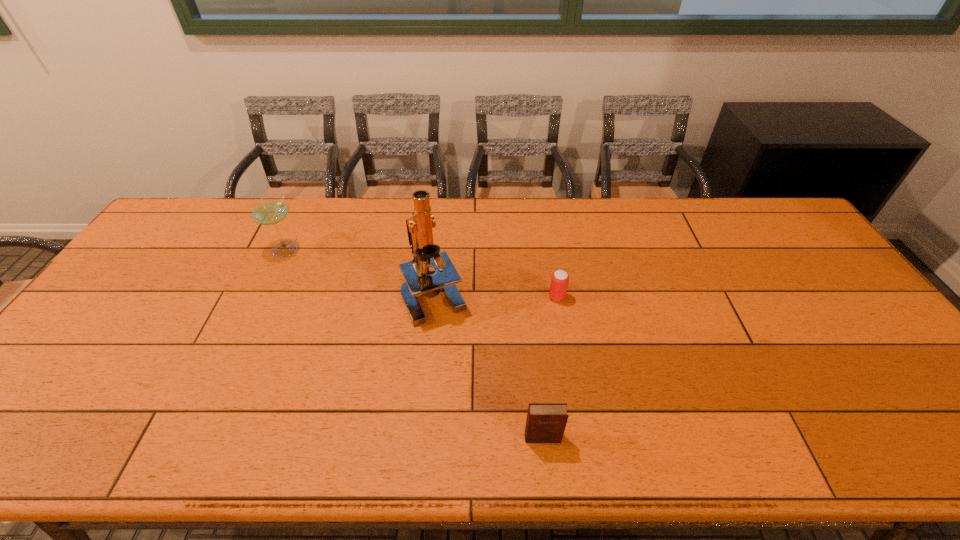
Image resolution: width=960 pixels, height=540 pixels. Find the location of `unoccupied position between the rightmost object and the second object from right to left`. unoccupied position between the rightmost object and the second object from right to left is located at coordinates (550, 367).

I want to click on free space that is in between the rightmost object and the second object from right to left, so click(550, 367).

Locate an element on the screen. This screenshot has width=960, height=540. empty space that is in between the farthest object and the third object from left to right is located at coordinates (414, 344).

Where is `unoccupied area between the shortest object and the third tallest object`? unoccupied area between the shortest object and the third tallest object is located at coordinates (550, 367).

Find the location of a particular element. empty space that is in between the rightmost object and the second object from left to right is located at coordinates (495, 296).

This screenshot has width=960, height=540. I want to click on vacant area that lies between the martini and the second object from right to left, so click(414, 344).

Where is `free space between the microscope and the shortest object`? Image resolution: width=960 pixels, height=540 pixels. free space between the microscope and the shortest object is located at coordinates (495, 296).

Identify which object is located as the second nearest to the second tallest object. Please provide its 2D coordinates. Your answer should be formatted as a tuple, i.e. [(x, y)], where the tuple contains the x and y coordinates of a point satisfying the conditions above.

[(559, 282)]

I want to click on object identified as the third closest to the diary, so click(268, 211).